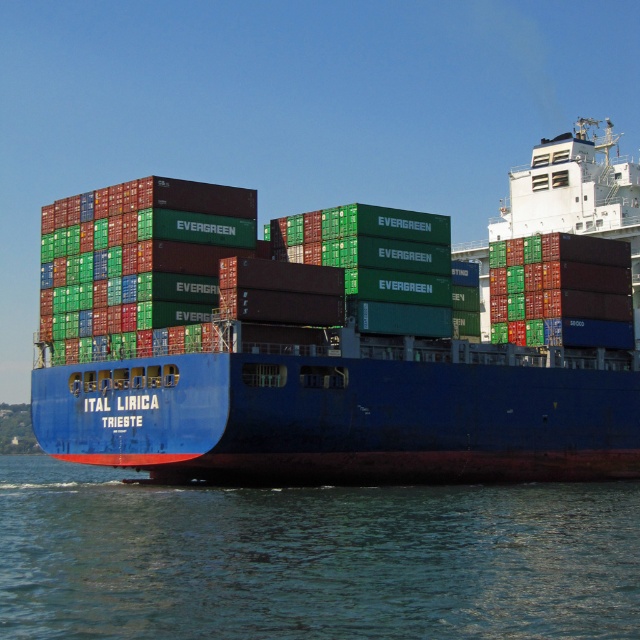
What is the position of the blue matte container ship at center relative to the blue water at lower center in the image?

The blue matte container ship at center is located above the blue water at lower center.

You are standing at the port and want to know how far the point at coordinates (221, 426) on the ship is from you. Can you determine the distance?

The distance of point (221, 426) from viewer is 55.68 meters.